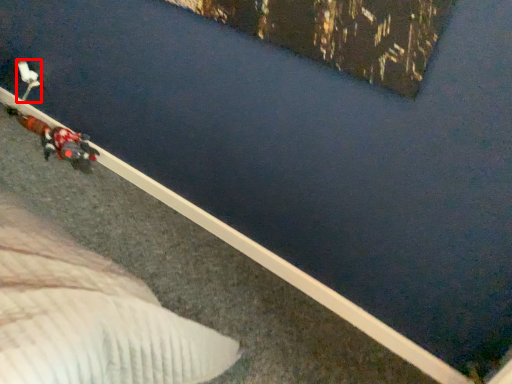
Question: From the image's perspective, what is the correct spatial positioning of toy (annotated by the red box) in reference to person?

Choices:
 (A) above
 (B) below

Answer: (A)